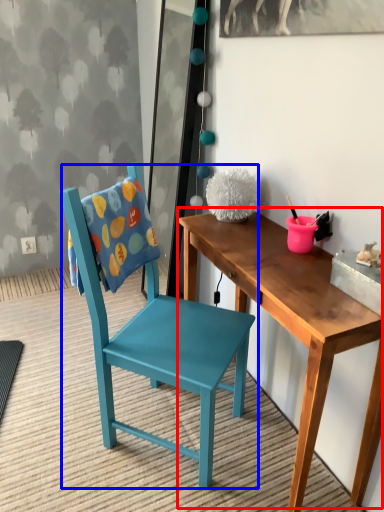
Question: Which object is closer to the camera taking this photo, table (highlighted by a red box) or chair (highlighted by a blue box)?

Choices:
 (A) table
 (B) chair

Answer: (A)